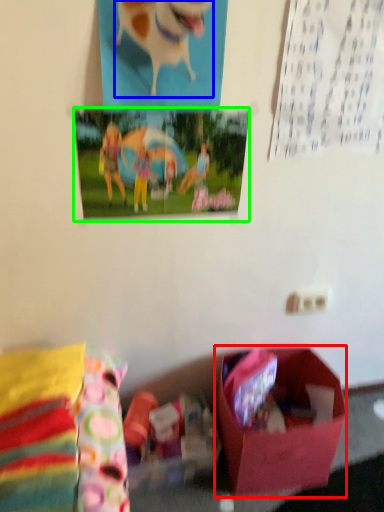
Question: Which object is the farthest from box (highlighted by a red box)? Choose among these: animal (highlighted by a blue box) or postcard (highlighted by a green box).

Choices:
 (A) animal
 (B) postcard

Answer: (A)